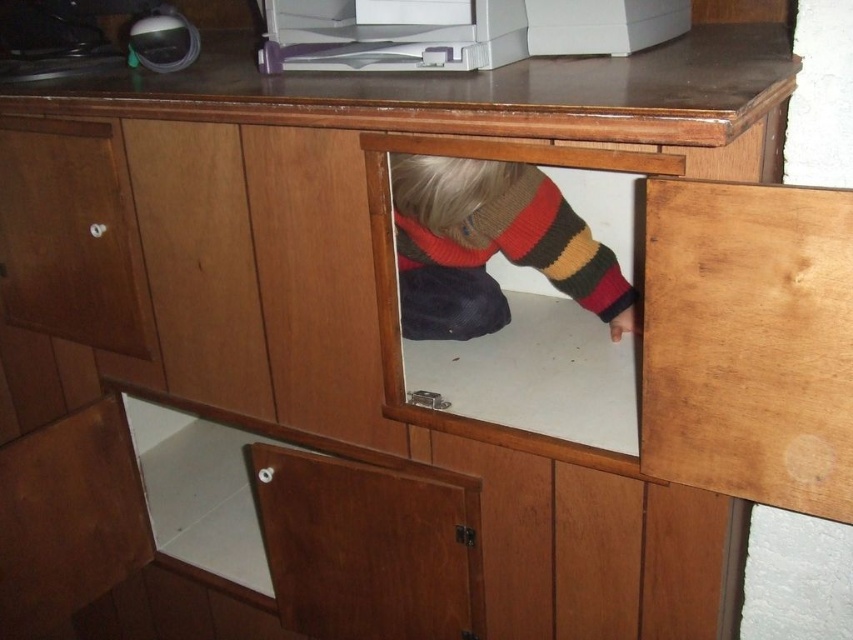
Question: Among these objects, which one is nearest to the camera?

Choices:
 (A) knitted sweater at center
 (B) matte wood drawer at left
 (C) white plastic printer at upper center

Answer: (C)

Question: Estimate the real-world distances between objects in this image. Which object is farther from the white plastic printer at upper center?

Choices:
 (A) matte wood drawer at left
 (B) knitted sweater at center

Answer: (A)

Question: Considering the real-world distances, which object is closest to the matte wood drawer at left?

Choices:
 (A) knitted sweater at center
 (B) white plastic printer at upper center

Answer: (B)

Question: Can you confirm if matte wood drawer at left is bigger than white plastic printer at upper center?

Choices:
 (A) no
 (B) yes

Answer: (B)

Question: Where is knitted sweater at center located in relation to white plastic printer at upper center in the image?

Choices:
 (A) right
 (B) left

Answer: (B)

Question: Observing the image, what is the correct spatial positioning of knitted sweater at center in reference to white plastic printer at upper center?

Choices:
 (A) above
 (B) below

Answer: (B)